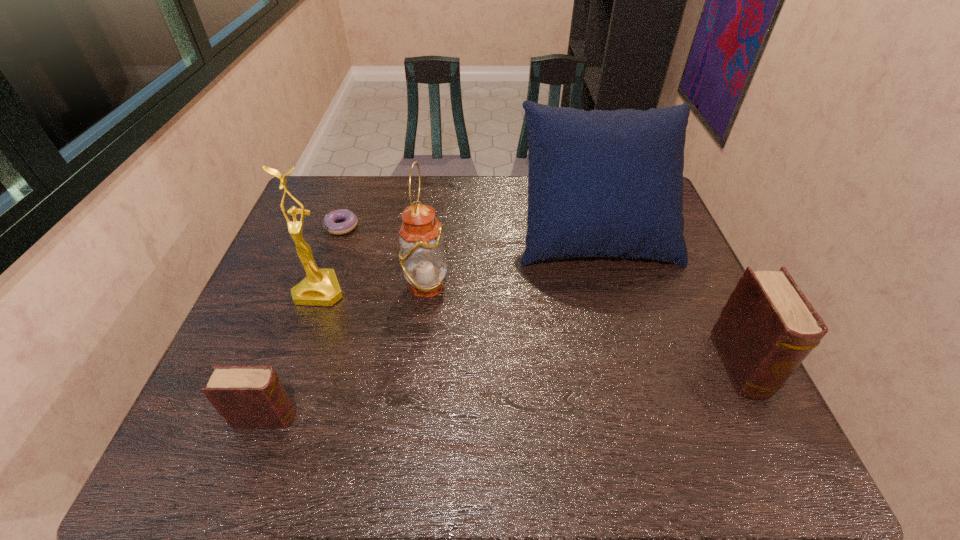
Image resolution: width=960 pixels, height=540 pixels. In order to click on object that stands as the fifth closest to the shortest object in this screenshot , I will do coord(767,328).

At what (x,y) coordinates should I click in order to perform the action: click on vacant space that satisfies the following two spatial constraints: 1. on the front side of the third object from right to left; 2. on the left side of the shortest object. Please return your answer as a coordinate pair (x, y). The height and width of the screenshot is (540, 960). Looking at the image, I should click on (321, 285).

Identify the location of free space that satisfies the following two spatial constraints: 1. on the front-facing side of the award; 2. on the spine side of the nearest object. Image resolution: width=960 pixels, height=540 pixels. (276, 417).